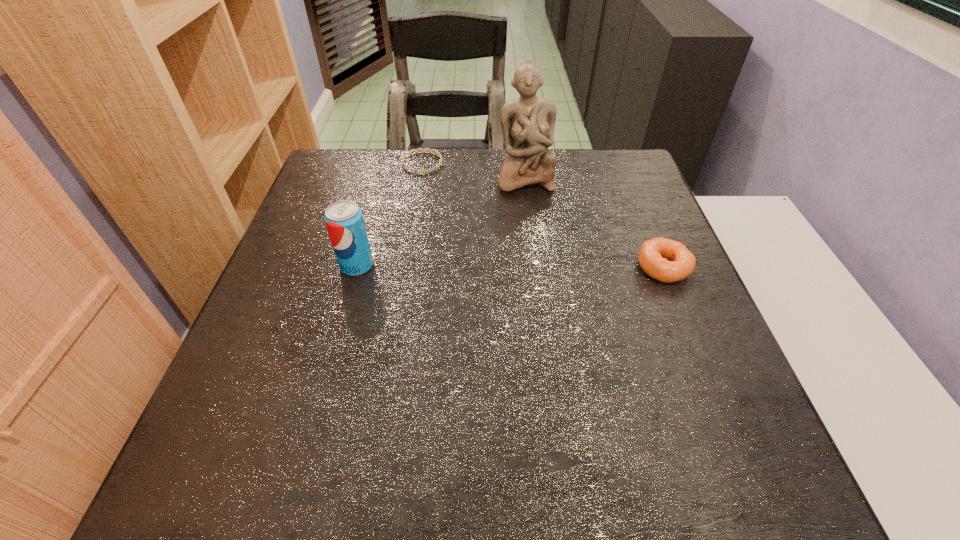
Identify the location of the leftmost object. (344, 220).

Find the location of a particular element. soda can is located at coordinates (344, 220).

Image resolution: width=960 pixels, height=540 pixels. Identify the location of the rightmost object. (652, 256).

In order to click on the third tallest object in this screenshot , I will do `click(652, 256)`.

Find the location of a particular element. The width and height of the screenshot is (960, 540). the tallest object is located at coordinates (528, 122).

Identify the location of figurine. The height and width of the screenshot is (540, 960). (528, 122).

You are a GUI agent. You are given a task and a screenshot of the screen. Output one action in this format:
    pyautogui.click(x=<x>, y=<y>)
    Task: Click on the bracelet
    
    Given the screenshot: What is the action you would take?
    pyautogui.click(x=430, y=151)

The image size is (960, 540). I want to click on the shortest object, so click(x=430, y=151).

Locate an element on the screen. The width and height of the screenshot is (960, 540). blank space located on the right of the soda can is located at coordinates (521, 265).

This screenshot has height=540, width=960. In order to click on free space located 0.220m on the front of the doughnut in this screenshot , I will do `click(708, 377)`.